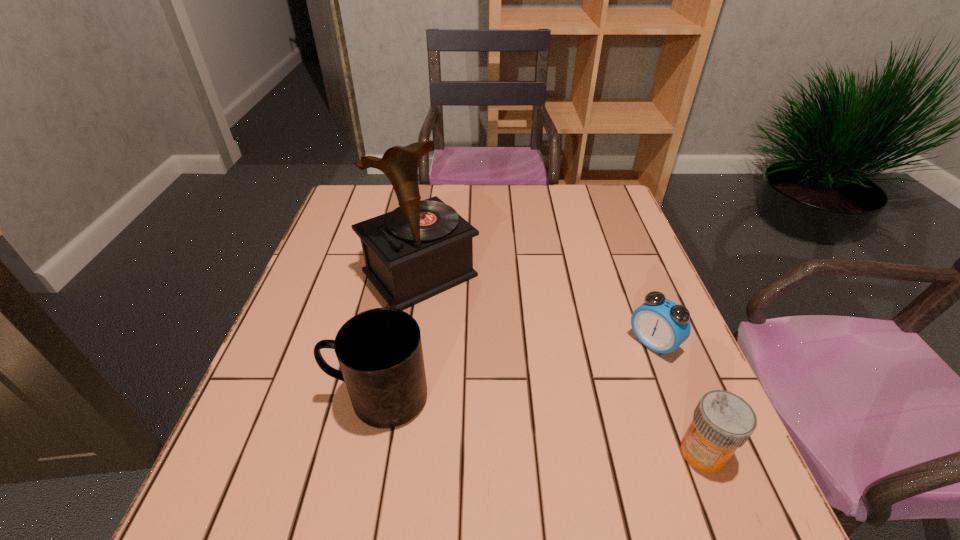
In order to click on free point at the near right corner in this screenshot , I will do `click(667, 428)`.

I want to click on empty space between the second farthest object and the mug, so click(516, 370).

Where is `free space between the medicine and the second farthest object`? free space between the medicine and the second farthest object is located at coordinates (678, 398).

Where is `empty location between the mug and the medicine`? The height and width of the screenshot is (540, 960). empty location between the mug and the medicine is located at coordinates (540, 425).

Where is `empty space that is in between the medicine and the mug`? This screenshot has width=960, height=540. empty space that is in between the medicine and the mug is located at coordinates (540, 425).

Locate an element on the screen. The height and width of the screenshot is (540, 960). vacant space that's between the phonograph_record and the third nearest object is located at coordinates (537, 308).

You are a GUI agent. You are given a task and a screenshot of the screen. Output one action in this format:
    pyautogui.click(x=<x>, y=<y>)
    Task: Click on the free space between the alarm clock and the phonograph_record
    
    Given the screenshot: What is the action you would take?
    pyautogui.click(x=537, y=308)

Where is `vacant space in between the medicine and the alarm clock`? Image resolution: width=960 pixels, height=540 pixels. vacant space in between the medicine and the alarm clock is located at coordinates (678, 398).

Locate an element on the screen. This screenshot has width=960, height=540. vacant space in between the mug and the alarm clock is located at coordinates (516, 370).

The image size is (960, 540). I want to click on object that is the second closest one to the phonograph_record, so click(660, 324).